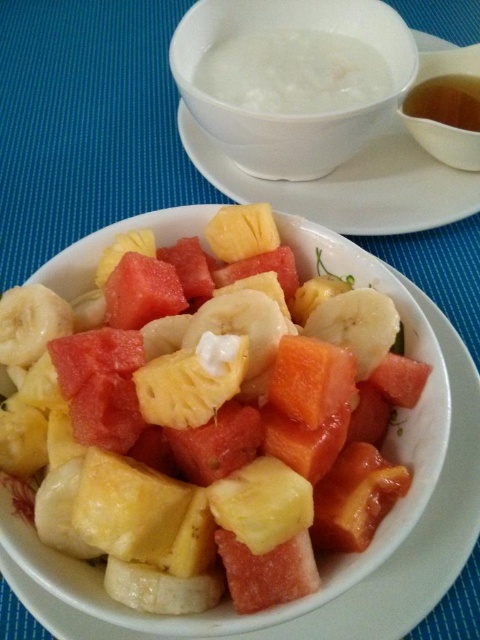
You are a food delivery person who needs to place two items on a tray. The items are the white creamy soup at upper center and the translucent brown liquid at upper right. The tray has a maximum load capacity of 30 centimeters between the two items. Can you safely place both items on the tray without exceeding the distance limit?

The white creamy soup at upper center is 22.76 centimeters away from the translucent brown liquid at upper right, which is within the tray maximum load capacity of 30 centimeters. So yes, you can safely place both items on the tray without exceeding the distance limit.

In the fruit salad scene, how far apart are the yellowish matte pineapple at center and the other white bowl on the right?

The yellowish matte pineapple at center and the other white bowl on the right are 21.81 inches apart.